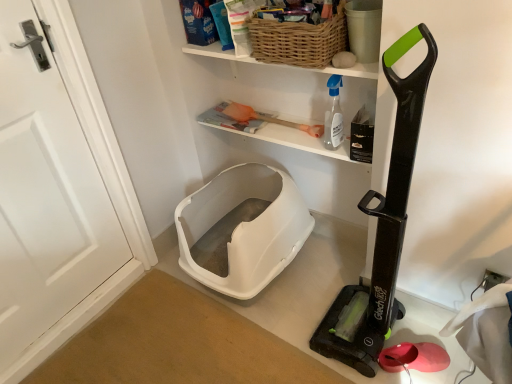
I want to click on free space behind black plastic vacuum cleaner at right, so click(x=328, y=276).